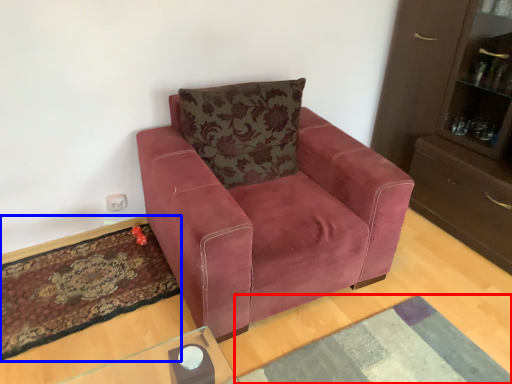
Question: Which object is closer to the camera taking this photo, mat (highlighted by a red box) or mat (highlighted by a blue box)?

Choices:
 (A) mat
 (B) mat

Answer: (A)